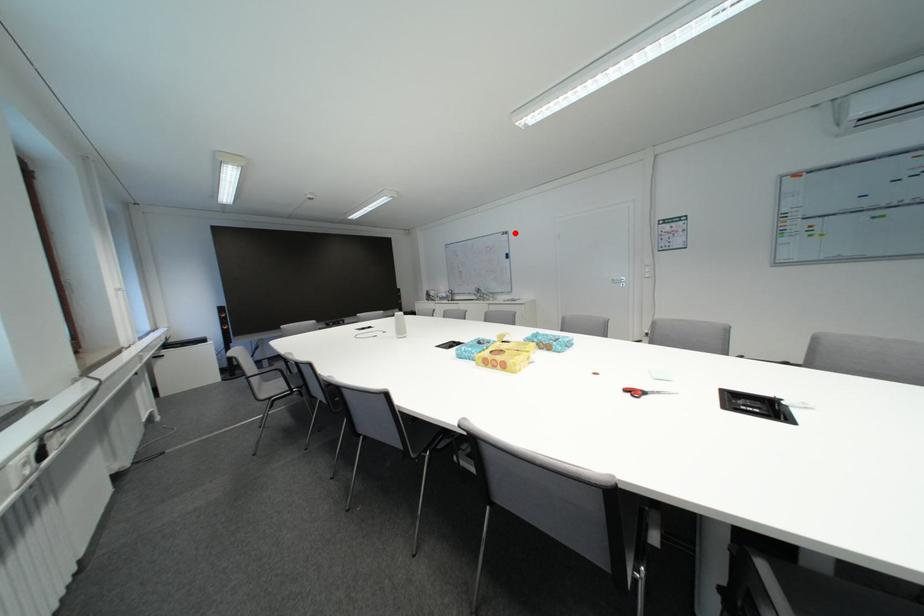
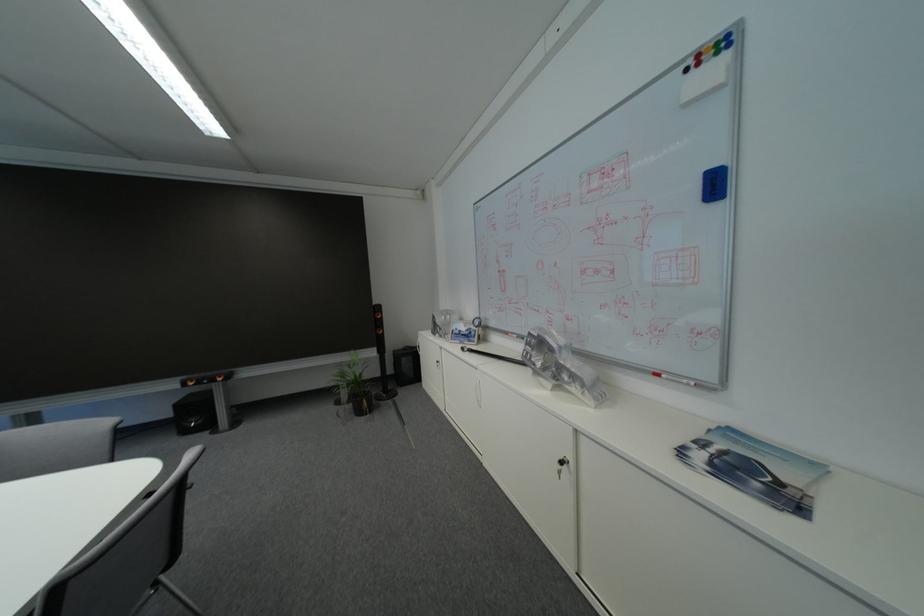
The point at the highlighted location is marked in the first image. Where is the corresponding point in the second image?

(723, 34)